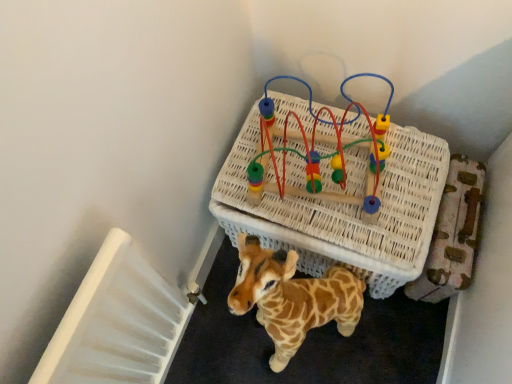
You are a GUI agent. You are given a task and a screenshot of the screen. Output one action in this format:
    pyautogui.click(x=<x>, y=<y>)
    Task: Click on the vacant area on top of white wicker basket at center (from a real-world perspective)
    This screenshot has width=512, height=384.
    Given the screenshot: What is the action you would take?
    click(x=304, y=168)